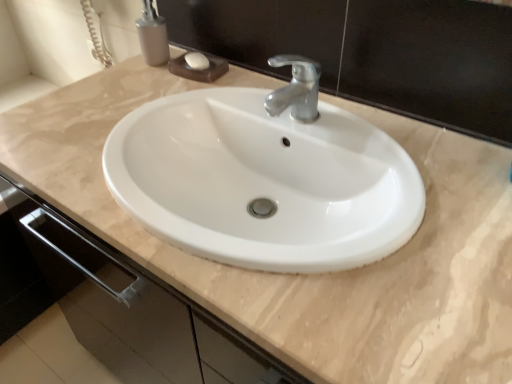
Question: Considering the relative positions of white glossy soap at upper center and matte gray soap dispenser at upper left in the image provided, is white glossy soap at upper center to the left or to the right of matte gray soap dispenser at upper left?

Choices:
 (A) right
 (B) left

Answer: (A)

Question: Based on their sizes in the image, would you say white glossy soap at upper center is bigger or smaller than matte gray soap dispenser at upper left?

Choices:
 (A) small
 (B) big

Answer: (A)

Question: From a real-world perspective, is white glossy soap at upper center above or below matte gray soap dispenser at upper left?

Choices:
 (A) below
 (B) above

Answer: (A)

Question: Would you say matte gray soap dispenser at upper left is to the left or to the right of white glossy soap at upper center in the picture?

Choices:
 (A) left
 (B) right

Answer: (A)

Question: Considering their positions, is matte gray soap dispenser at upper left located in front of or behind white glossy soap at upper center?

Choices:
 (A) front
 (B) behind

Answer: (A)

Question: From the image's perspective, is matte gray soap dispenser at upper left above or below white glossy soap at upper center?

Choices:
 (A) above
 (B) below

Answer: (A)

Question: Is matte gray soap dispenser at upper left bigger or smaller than white glossy soap at upper center?

Choices:
 (A) big
 (B) small

Answer: (A)